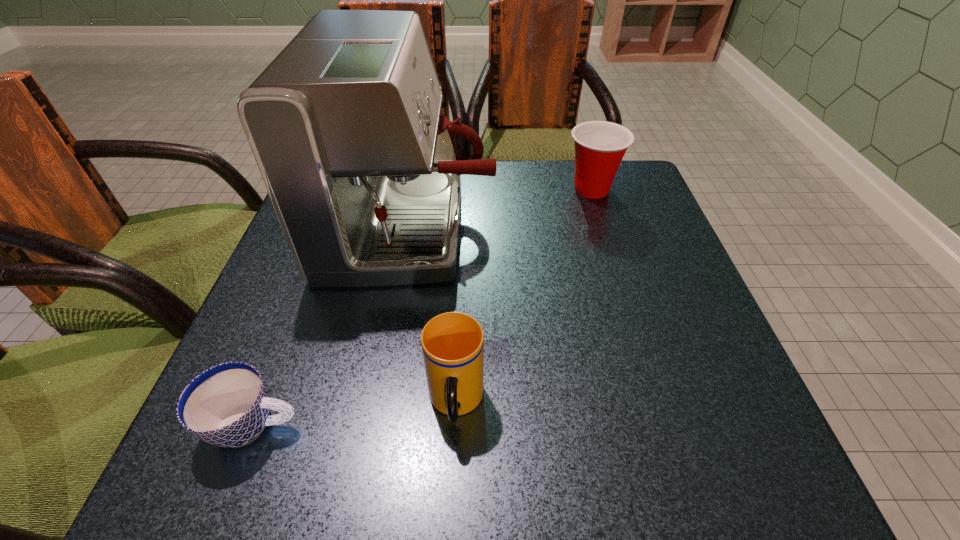
What are the coordinates of `coffee maker positioned at the far edge` in the screenshot? It's located at click(345, 124).

In order to click on cup located at the far edge in this screenshot , I will do `click(600, 146)`.

The height and width of the screenshot is (540, 960). I want to click on coffee maker that is at the left edge, so click(345, 124).

In order to click on cup located at the left edge in this screenshot , I will do `click(227, 405)`.

You are a GUI agent. You are given a task and a screenshot of the screen. Output one action in this format:
    pyautogui.click(x=<x>, y=<y>)
    Task: Click on the object situated at the right edge
    
    Given the screenshot: What is the action you would take?
    pyautogui.click(x=600, y=146)

The image size is (960, 540). In order to click on object situated at the far left corner in this screenshot , I will do `click(345, 124)`.

This screenshot has width=960, height=540. I want to click on object located in the near left corner section of the desktop, so click(227, 405).

Locate an element on the screen. object that is at the far right corner is located at coordinates (600, 146).

Identify the location of vacant space at the far edge of the desktop. The width and height of the screenshot is (960, 540). (526, 180).

I want to click on free point at the near edge, so click(481, 464).